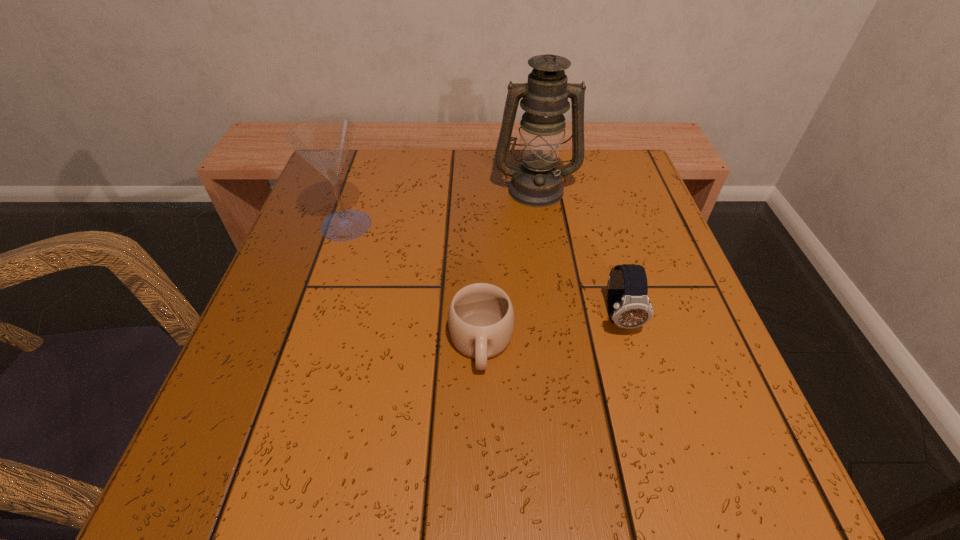
You are a GUI agent. You are given a task and a screenshot of the screen. Output one action in this format:
    pyautogui.click(x=<x>, y=<y>)
    Task: Click on the object located in the left edge section of the desktop
    This screenshot has height=540, width=960.
    Given the screenshot: What is the action you would take?
    pyautogui.click(x=325, y=142)

Where is `oil lamp at the right edge`? Image resolution: width=960 pixels, height=540 pixels. oil lamp at the right edge is located at coordinates click(x=537, y=182).

This screenshot has width=960, height=540. Find the location of `watch present at the right edge`. watch present at the right edge is located at coordinates (628, 304).

The height and width of the screenshot is (540, 960). Find the location of `object present at the far right corner`. object present at the far right corner is located at coordinates click(537, 182).

What are the coordinates of `vacant space at the near edge of the desktop` in the screenshot? It's located at (356, 472).

This screenshot has width=960, height=540. I want to click on free spot at the left edge of the desktop, so click(x=243, y=352).

I want to click on free space at the right edge of the desktop, so click(x=680, y=305).

The height and width of the screenshot is (540, 960). I want to click on vacant point at the far left corner, so click(x=343, y=205).

In the image, there is a desktop. Identify the location of vacant region at the near left corner. This screenshot has height=540, width=960. (285, 479).

In the image, there is a desktop. Where is `vacant space at the far right corner`? vacant space at the far right corner is located at coordinates (602, 161).